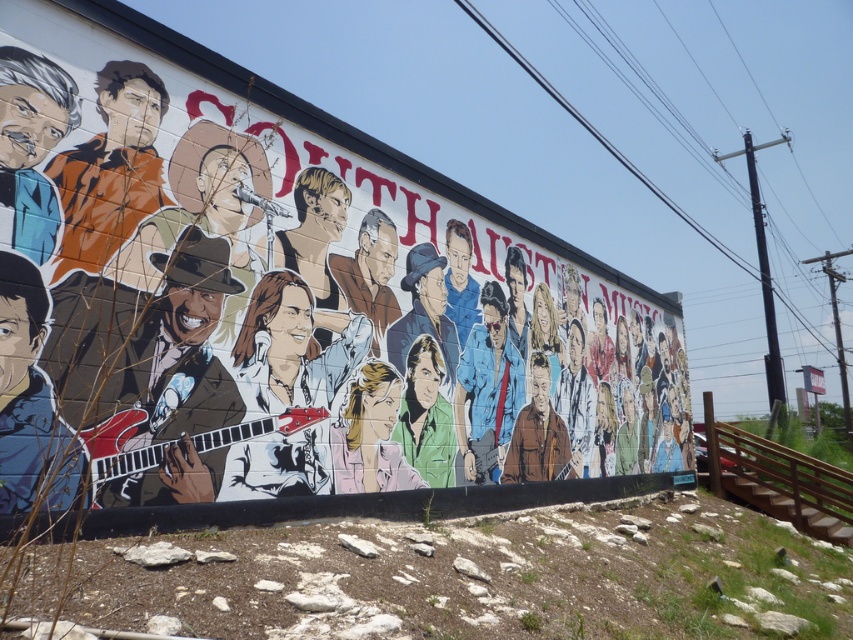
Question: Which of the following is the farthest from the observer?

Choices:
 (A) matte brown jacket at left
 (B) brown leather jacket at center
 (C) matte painted mural at center
 (D) shiny black guitar at center

Answer: (B)

Question: Which point is closer to the camera?

Choices:
 (A) (7, 304)
 (B) (550, 429)

Answer: (A)

Question: Considering the real-world distances, which object is farthest from the green matte shirt at center?

Choices:
 (A) matte painted mural at center
 (B) brown leather jacket at center

Answer: (A)

Question: Does smooth skin portrait at center lie in front of brown leather jacket at center?

Choices:
 (A) yes
 (B) no

Answer: (A)

Question: Can you confirm if matte painted mural at center is positioned to the left of white glossy guitar at center?

Choices:
 (A) no
 (B) yes

Answer: (A)

Question: Can you confirm if orange fabric shirt at upper left is positioned above blue denim jacket at center?

Choices:
 (A) no
 (B) yes

Answer: (B)